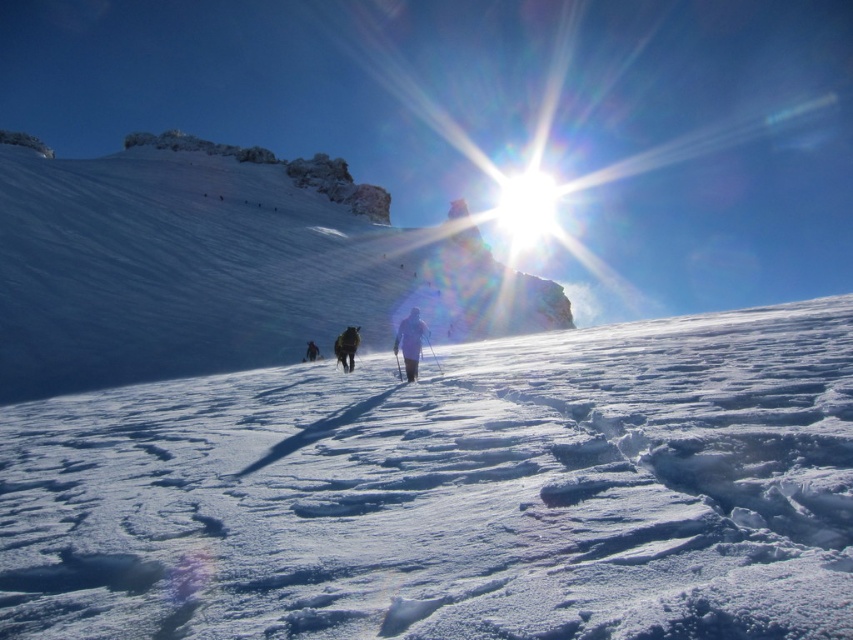
You are a photographer standing at the camera position. You want to take a photo of both point [201,296] and point [404,356] in the scene. Which point will appear closer to the front of the photo?

Point [201,296] is further to the camera than point [404,356], so it will appear closer to the front of the photo.